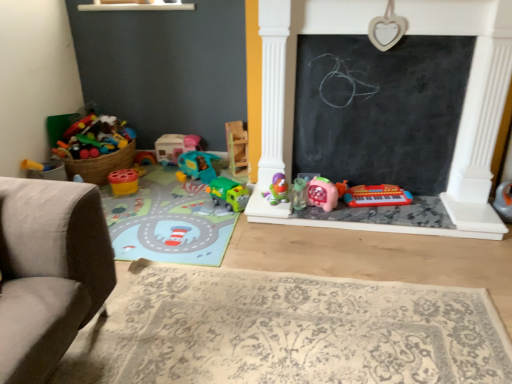
Image resolution: width=512 pixels, height=384 pixels. I want to click on vacant area that is in front of teal plastic toy car at center, which appears as the 3th toy when viewed from the left, so click(184, 190).